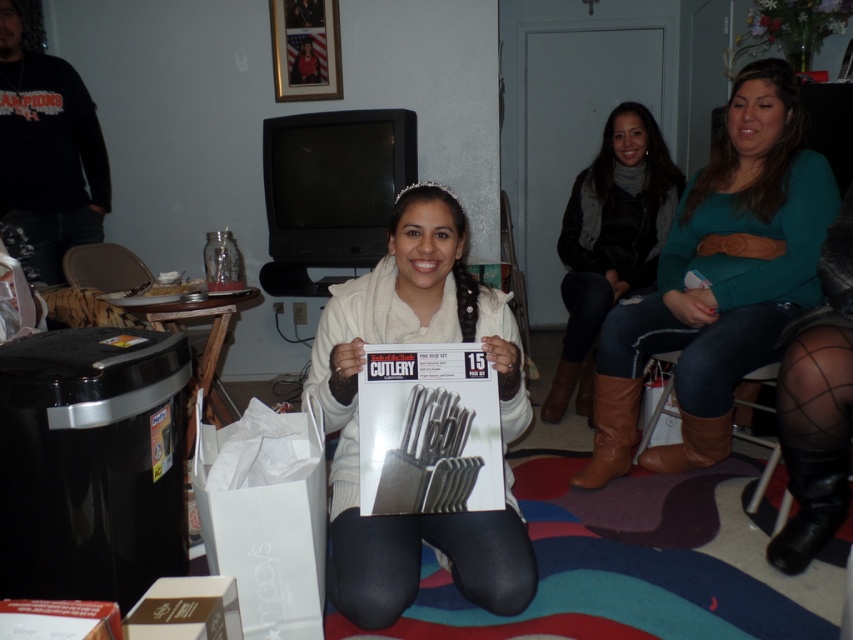
Is dark brown leather boots at right thinner than brown leather boot at lower right?

In fact, dark brown leather boots at right might be wider than brown leather boot at lower right.

Does dark brown leather boots at right appear on the left side of brown leather boot at lower right?

In fact, dark brown leather boots at right is to the right of brown leather boot at lower right.

Who is more forward, [612,250] or [628,403]?

Positioned in front is point [628,403].

At what (x,y) coordinates should I click in order to perform the action: click on dark brown leather boots at right. Please return your answer as a coordinate pair (x, y). This screenshot has height=640, width=853. Looking at the image, I should click on (610, 241).

Locate an element on the screen. dark brown leather boots at right is located at coordinates (610, 241).

In the scene shown: Who is lower down, dark brown leather boots at right or brown suede boot at lower right?

brown suede boot at lower right is below.

Is point (628, 129) closer to viewer compared to point (683, 435)?

No.

You are a GUI agent. You are given a task and a screenshot of the screen. Output one action in this format:
    pyautogui.click(x=<x>, y=<y>)
    Task: Click on the dark brown leather boots at right
    
    Given the screenshot: What is the action you would take?
    click(610, 241)

Can you confirm if dark brown leather boots at right is positioned above black leather boot at lower right?

Yes, dark brown leather boots at right is above black leather boot at lower right.

Identify the location of dark brown leather boots at right. The width and height of the screenshot is (853, 640). (610, 241).

The image size is (853, 640). Identify the location of dark brown leather boots at right. (610, 241).

Locate an element on the screen. dark brown leather boots at right is located at coordinates (610, 241).